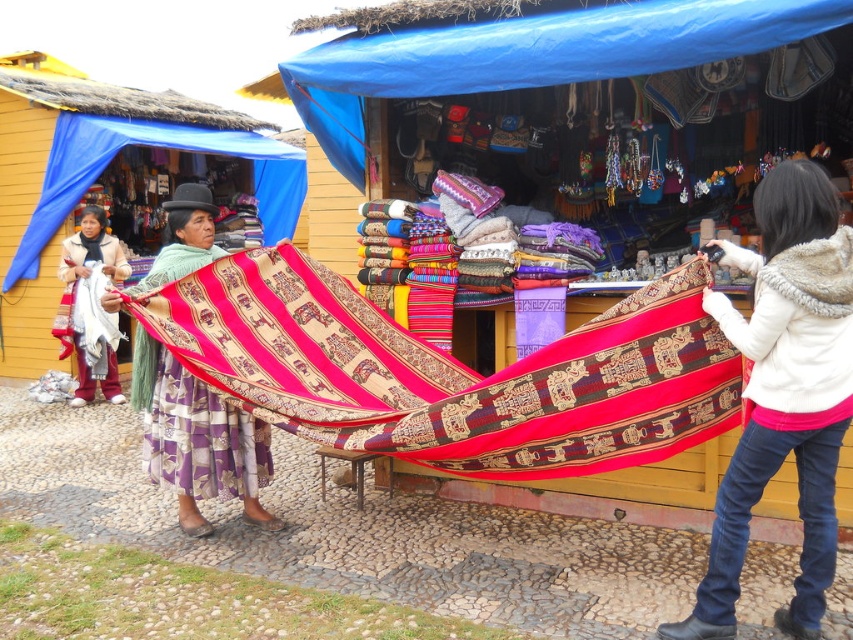
Can you confirm if textured woolen fabric at center is taller than white woven textile at center?

Yes, textured woolen fabric at center is taller than white woven textile at center.

Does textured woolen fabric at center appear on the left side of white woven textile at center?

No, textured woolen fabric at center is not to the left of white woven textile at center.

Is point (158, 406) more distant than point (91, 236)?

No, it is not.

At what (x,y) coordinates should I click in order to perform the action: click on textured woolen fabric at center. Please return your answer as a coordinate pair (x, y). Looking at the image, I should click on (194, 429).

Based on the photo, does textured woven blanket at center have a greater width compared to white fur-lined jacket at right?

Correct, the width of textured woven blanket at center exceeds that of white fur-lined jacket at right.

Is textured woven blanket at center taller than white fur-lined jacket at right?

Incorrect, textured woven blanket at center's height is not larger of white fur-lined jacket at right's.

Who is more forward, (422, 371) or (753, 468)?

Point (753, 468) is more forward.

The image size is (853, 640). What are the coordinates of `textured woven blanket at center` in the screenshot? It's located at (450, 371).

Between white fur-lined jacket at right and white woven textile at center, which one is positioned lower?

white fur-lined jacket at right

Between white fur-lined jacket at right and white woven textile at center, which one is positioned higher?

white woven textile at center is above.

Where is `white fur-lined jacket at right`? This screenshot has height=640, width=853. white fur-lined jacket at right is located at coordinates (784, 394).